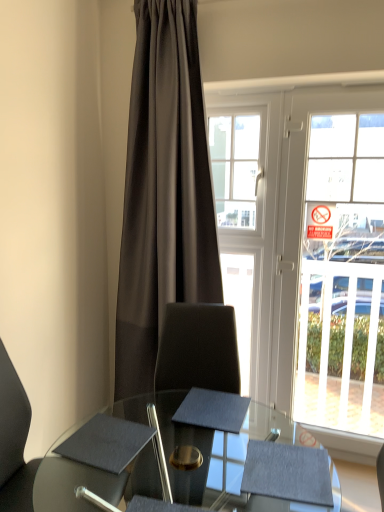
Question: From a real-world perspective, does matte black chair at lower left stand above dark gray fabric curtain at center?

Choices:
 (A) no
 (B) yes

Answer: (A)

Question: Is matte black chair at lower left closer to camera compared to dark gray fabric curtain at center?

Choices:
 (A) yes
 (B) no

Answer: (A)

Question: Can you confirm if matte black chair at lower left is shorter than dark gray fabric curtain at center?

Choices:
 (A) no
 (B) yes

Answer: (B)

Question: Is dark gray fabric curtain at center a part of matte black chair at lower left?

Choices:
 (A) no
 (B) yes

Answer: (A)

Question: Is matte black chair at lower left far from dark gray fabric curtain at center?

Choices:
 (A) yes
 (B) no

Answer: (A)

Question: Considering the relative positions of matte black chair at lower left and dark gray fabric curtain at center in the image provided, is matte black chair at lower left to the left of dark gray fabric curtain at center from the viewer's perspective?

Choices:
 (A) yes
 (B) no

Answer: (A)

Question: From the image's perspective, would you say matte black chair at lower left is shown under matte black glass table at center?

Choices:
 (A) yes
 (B) no

Answer: (B)

Question: Can you confirm if matte black chair at lower left is shorter than matte black glass table at center?

Choices:
 (A) no
 (B) yes

Answer: (A)

Question: Is matte black chair at lower left thinner than matte black glass table at center?

Choices:
 (A) no
 (B) yes

Answer: (B)

Question: Is matte black chair at lower left facing towards matte black glass table at center?

Choices:
 (A) no
 (B) yes

Answer: (B)

Question: Considering the relative sizes of matte black chair at lower left and matte black glass table at center in the image provided, is matte black chair at lower left bigger than matte black glass table at center?

Choices:
 (A) yes
 (B) no

Answer: (B)

Question: From a real-world perspective, is matte black chair at lower left below matte black glass table at center?

Choices:
 (A) yes
 (B) no

Answer: (B)

Question: From the image's perspective, would you say clear glass bay window at center is positioned over dark gray fabric curtain at center?

Choices:
 (A) yes
 (B) no

Answer: (A)